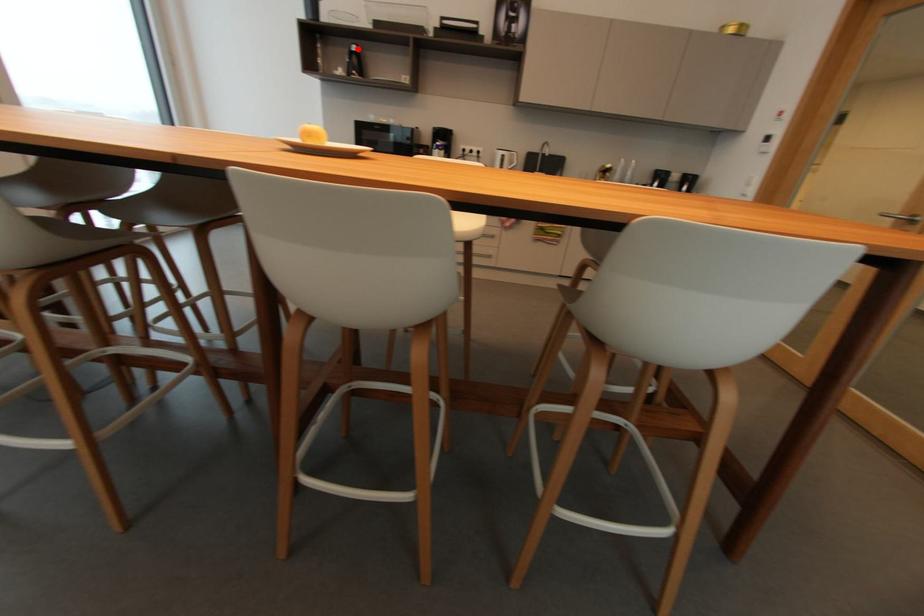
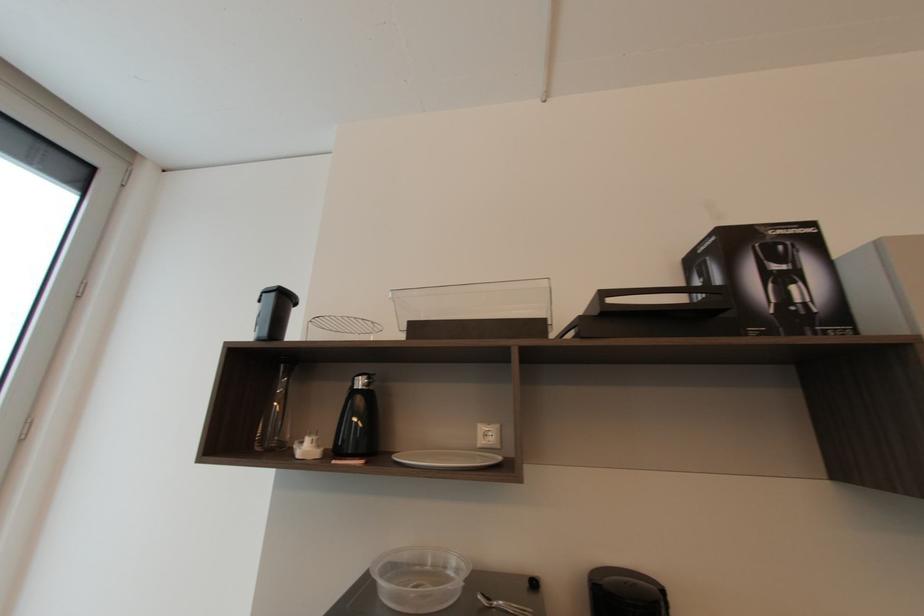
The point at the highlighted location is marked in the first image. Where is the corresponding point in the second image?

(362, 384)